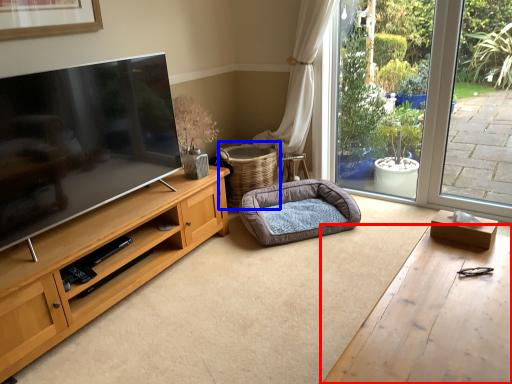
Question: Which point is closer to the camera, desk (highlighted by a red box) or basket (highlighted by a blue box)?

Choices:
 (A) desk
 (B) basket

Answer: (A)